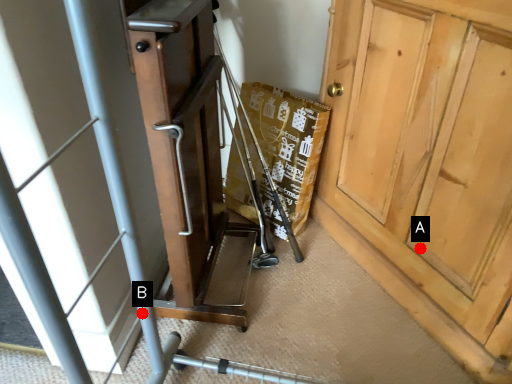
Question: Two points are circled on the image, labeled by A and B beside each circle. Which point is closer to the camera?

Choices:
 (A) A is closer
 (B) B is closer

Answer: (B)